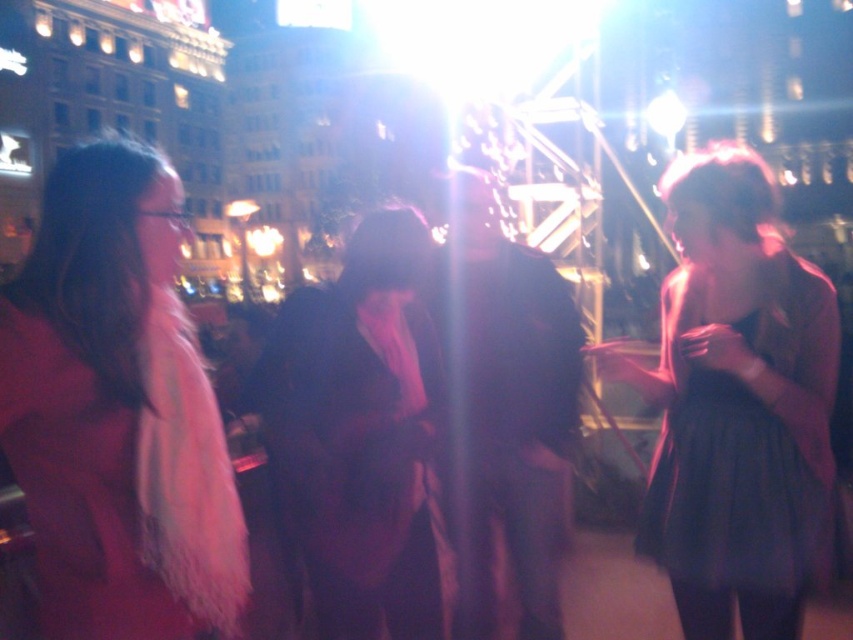
You are a photographer trying to capture a clear shot of the matte pink coat at left and the velvet black coat at center. Based on their heights, which coat should you focus on first to ensure it fits entirely within your camera frame?

The matte pink coat at left is not as tall as velvet black coat at center, so you should focus on the velvet black coat at center first to ensure it fits entirely within your camera frame since it is taller.

You are a photographer trying to adjust the focus of your camera to capture the velvet black coat at center and the dark brown leather jacket at center. Which one should you focus on first if you want to ensure both are in focus?

The velvet black coat at center is positioned under the dark brown leather jacket at center, so you should focus on the dark brown leather jacket at center first as it is closer to the camera.